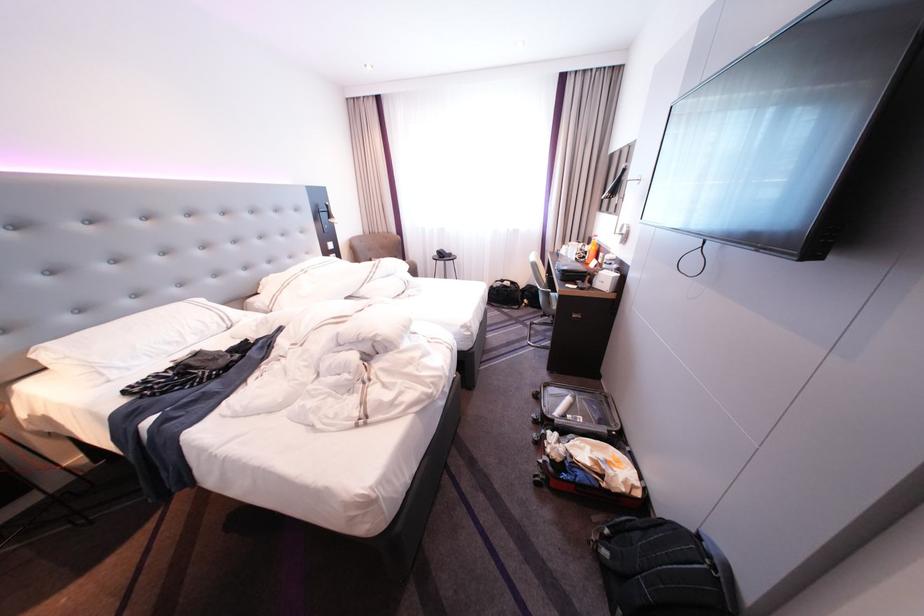
Find where to pull the suitcase handle. Please return your answer as a coordinate pair (x, y).

(631, 468)